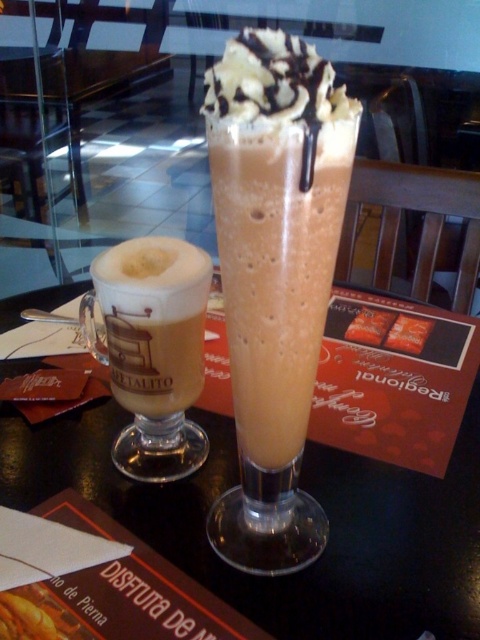
Question: Which object is positioned closest to the translucent glass table at center?

Choices:
 (A) matte glass mug at left
 (B) whipped cream topped chocolate milkshake at center

Answer: (A)

Question: Observing the image, what is the correct spatial positioning of translucent glass table at center in reference to matte glass mug at left?

Choices:
 (A) right
 (B) left

Answer: (A)

Question: Does whipped cream topped chocolate milkshake at center have a smaller size compared to matte glass mug at left?

Choices:
 (A) no
 (B) yes

Answer: (A)

Question: Does translucent glass table at center appear on the left side of matte glass mug at left?

Choices:
 (A) yes
 (B) no

Answer: (B)

Question: Which is farther from the matte glass mug at left?

Choices:
 (A) whipped cream topped chocolate milkshake at center
 (B) translucent glass table at center

Answer: (B)

Question: Which of these objects is positioned closest to the translucent glass table at center?

Choices:
 (A) whipped cream topped chocolate milkshake at center
 (B) matte glass mug at left

Answer: (B)